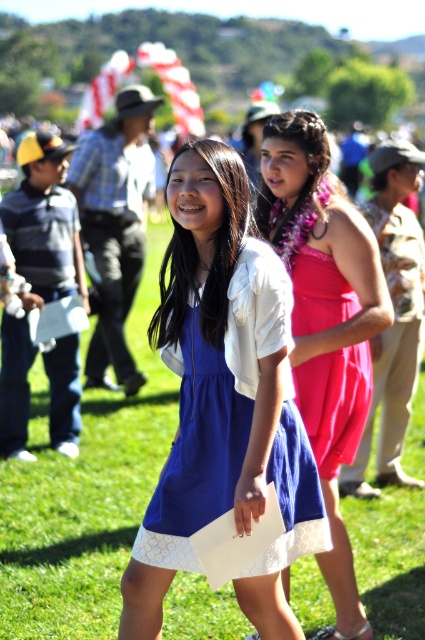
Is shiny pink dress at center to the left of blue satin dress at center from the viewer's perspective?

Incorrect, shiny pink dress at center is not on the left side of blue satin dress at center.

Is shiny pink dress at center in front of blue satin dress at center?

No, it is not.

Who is more forward, (286, 216) or (312, 531)?

Positioned in front is point (312, 531).

I want to click on shiny pink dress at center, so click(325, 321).

The height and width of the screenshot is (640, 425). I want to click on blue satin dress at center, so click(226, 477).

Is blue satin dress at center to the left of pink satin dress at center from the viewer's perspective?

Yes, blue satin dress at center is to the left of pink satin dress at center.

Is point (189, 536) more distant than point (308, 432)?

No, (189, 536) is in front of (308, 432).

At what (x,y) coordinates should I click in order to perform the action: click on blue satin dress at center. Please return your answer as a coordinate pair (x, y). The width and height of the screenshot is (425, 640). Looking at the image, I should click on (226, 477).

Is shiny pink dress at center wider than pink satin dress at center?

Indeed, shiny pink dress at center has a greater width compared to pink satin dress at center.

Can you confirm if shiny pink dress at center is thinner than pink satin dress at center?

Incorrect, shiny pink dress at center's width is not less than pink satin dress at center's.

Does point (337, 371) come farther from viewer compared to point (325, 378)?

No, (337, 371) is closer to viewer.

This screenshot has height=640, width=425. Identify the location of shiny pink dress at center. (325, 321).